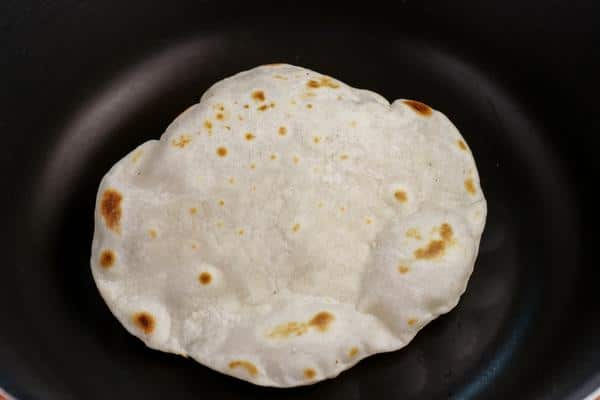
I want to click on width of cooking space of pan, so click(x=494, y=364), click(x=114, y=87).